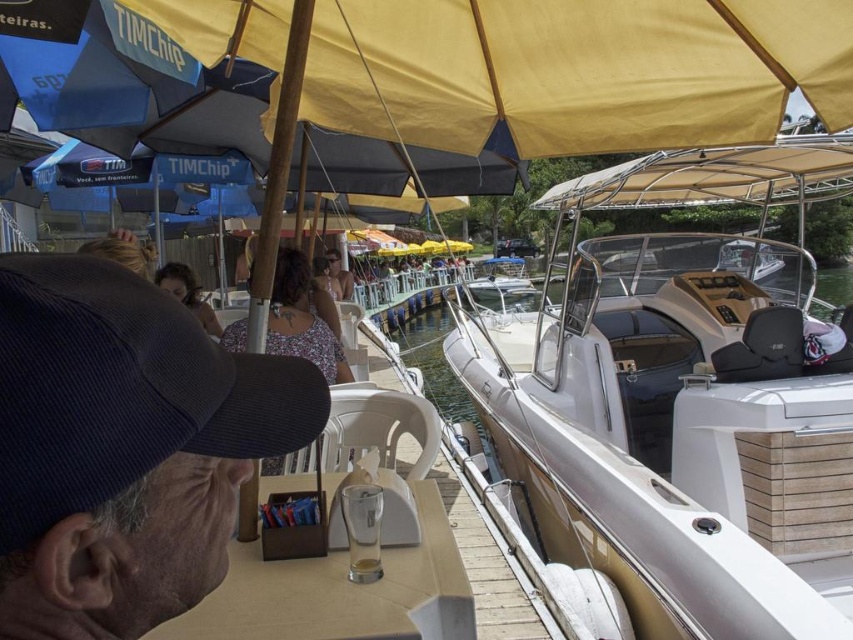
I want to click on white glossy boat at center, so click(x=682, y=401).

Between white glossy boat at center and dark blue corduroy baseball cap at upper left, which one appears on the left side from the viewer's perspective?

From the viewer's perspective, dark blue corduroy baseball cap at upper left appears more on the left side.

This screenshot has width=853, height=640. What do you see at coordinates (682, 401) in the screenshot? I see `white glossy boat at center` at bounding box center [682, 401].

Locate an element on the screen. The image size is (853, 640). white glossy boat at center is located at coordinates (682, 401).

Describe the element at coordinates (122, 390) in the screenshot. I see `dark blue corduroy baseball cap at upper left` at that location.

Between dark blue corduroy baseball cap at upper left and floral fabric dress at center, which one has more height?

With more height is floral fabric dress at center.

Does point (158, 360) come farther from viewer compared to point (335, 349)?

No, it is in front of (335, 349).

The height and width of the screenshot is (640, 853). Find the location of `dark blue corduroy baseball cap at upper left`. dark blue corduroy baseball cap at upper left is located at coordinates (122, 390).

Does white glossy boat at center have a smaller size compared to dark brown hair at center?

No, white glossy boat at center is not smaller than dark brown hair at center.

Is point (561, 356) closer to camera compared to point (173, 288)?

That is False.

Image resolution: width=853 pixels, height=640 pixels. What do you see at coordinates (682, 401) in the screenshot?
I see `white glossy boat at center` at bounding box center [682, 401].

Identify the location of white glossy boat at center. (682, 401).